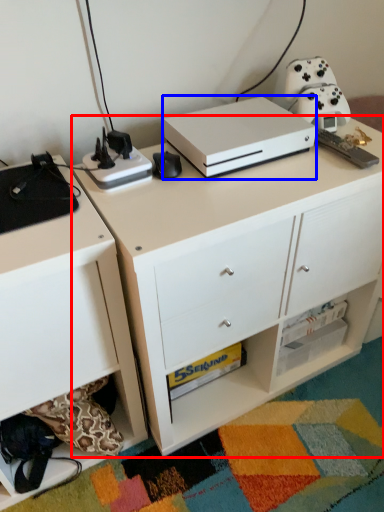
Question: Which point is closer to the camera, desk (highlighted by a red box) or appliance (highlighted by a blue box)?

Choices:
 (A) desk
 (B) appliance

Answer: (A)